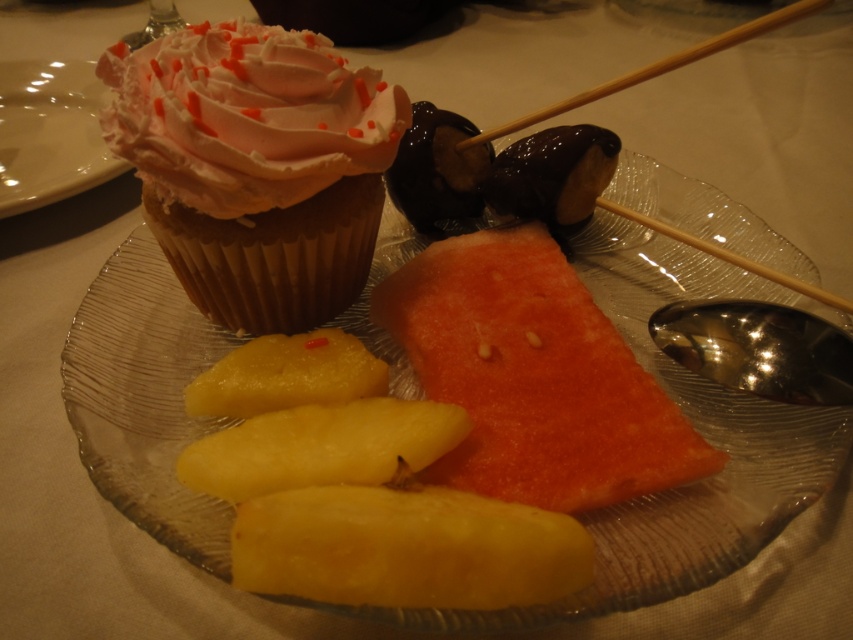
You are a food stylist arranging items on a dessert plate. You need to place a new chocolate truffle at the point with coordinates (256, 166). However, there is already an item at that location. What is the item blocking the placement of the chocolate truffle?

The point (256, 166) is occupied by the matte pink frosting cupcake at upper left.

You are a food stylist arranging desserts on a plate. You have a matte pink frosting cupcake at upper left and a yellow smooth pineapple at lower center. Which item is taller?

The matte pink frosting cupcake at upper left is much taller than the yellow smooth pineapple at lower center.

You are looking at the dessert plate setup. Where is the translucent glass plate at upper center located in terms of its 2D coordinates?

The translucent glass plate at upper center is located at the 2D coordinates of point (699, 433).